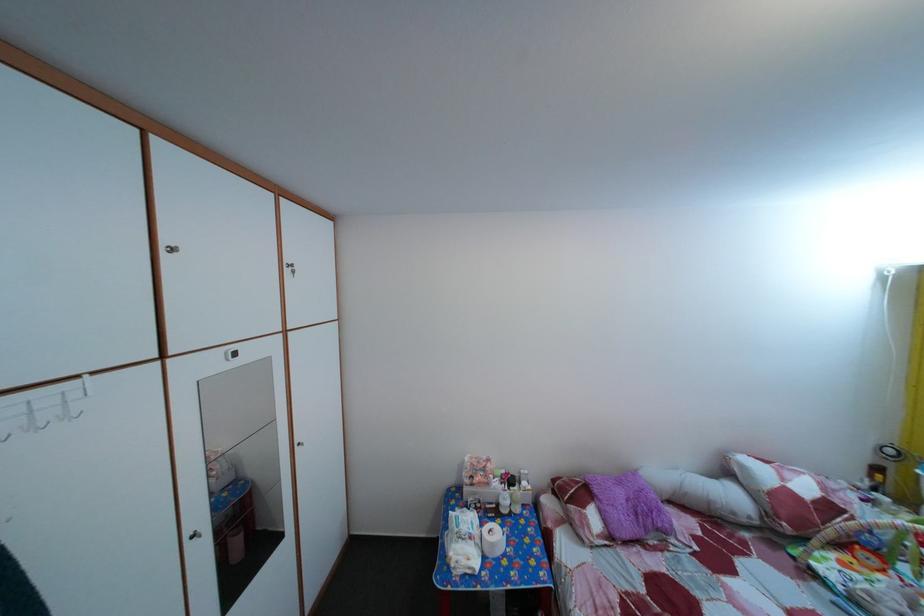
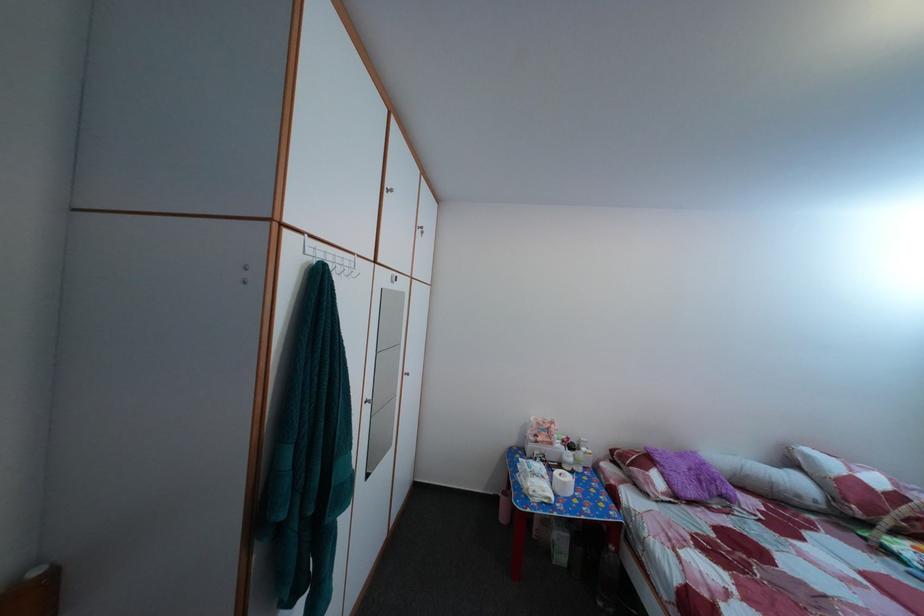
Find the pixel in the second image that matches pixel 752 475 in the first image.

(817, 464)